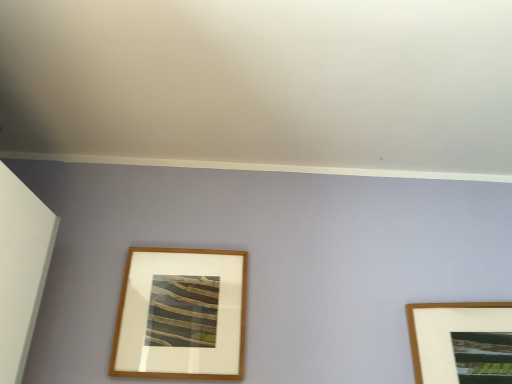
Where is `wooden frame at center`? wooden frame at center is located at coordinates (181, 315).

What do you see at coordinates (181, 315) in the screenshot?
I see `wooden frame at center` at bounding box center [181, 315].

I want to click on wooden frame at center, so click(181, 315).